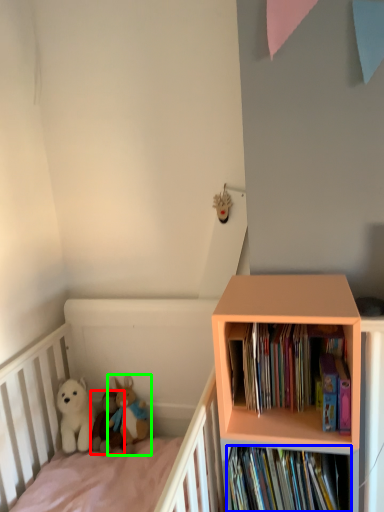
Question: Which object is the farthest from toy (highlighted by a red box)? Choose among these: book (highlighted by a blue box) or toy (highlighted by a green box).

Choices:
 (A) book
 (B) toy

Answer: (A)